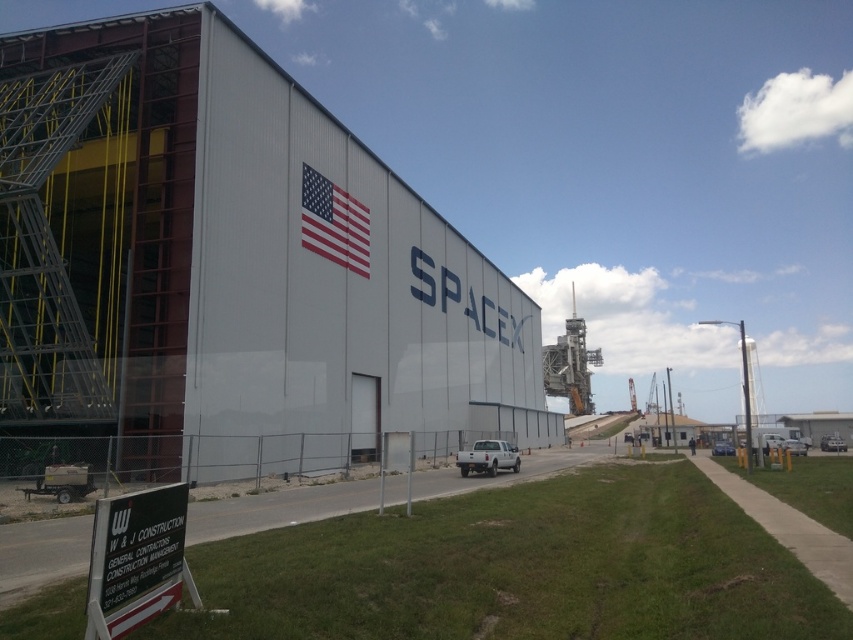
You are standing at the SpaceX building and want to park your silver metallic sedan at lower right. The parking spot you want is at point (833, 444). Is your car already there?

Yes, the silver metallic sedan at lower right is already parked at point (833, 444).

From the picture: You are a drone operator tasked with capturing aerial footage of the gray metallic building at center and the red fabric american flag at upper center. The drone has a camera with a 120 degree field of view. Can you determine if both objects can be captured in a single shot without moving the drone?

The gray metallic building at center might be wider than red fabric american flag at upper center, but without specific measurements of their widths and distances from the drone, it is impossible to confirm if they can fit within the 120 degree field of view. Additional information is needed to make this determination.

You are a delivery driver arriving at the SpaceX facility. You need to park your truck, which is 2 meters wide, in a spot that is not blocked by the gray metallic building at center or the white plastic sign at lower left. Can you determine if there is enough space between them to park your truck?

The gray metallic building at center might be wider than the white plastic sign at lower left, so there may not be enough space to park the truck between them. Check the actual distance before proceeding.